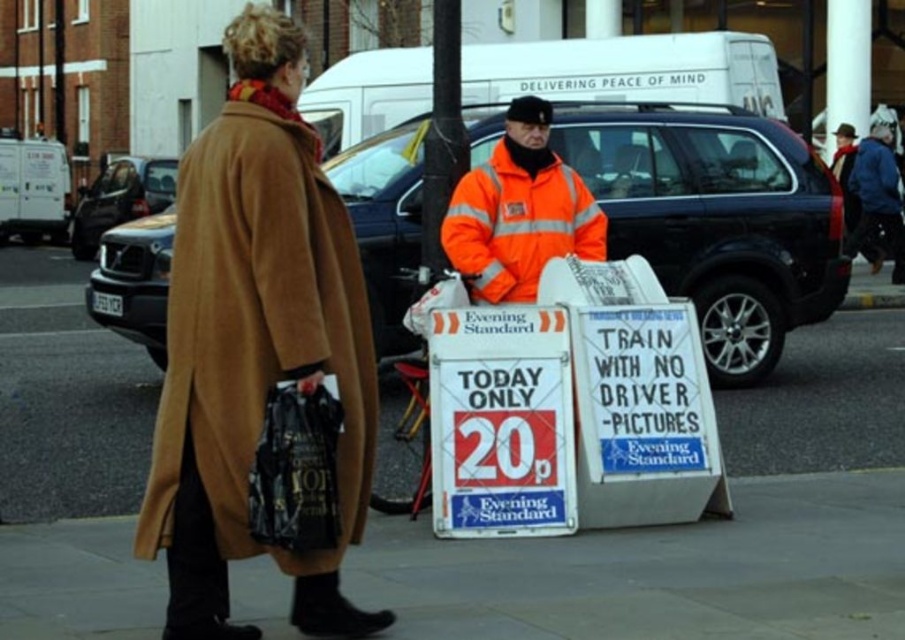
Question: Based on their relative distances, which object is farther from the smooth concrete pavement at lower center?

Choices:
 (A) high-visibility orange jacket at center
 (B) tan woolen coat at left

Answer: (B)

Question: From the image, what is the correct spatial relationship of tan woolen coat at left in relation to high-visibility orange jacket at center?

Choices:
 (A) left
 (B) right

Answer: (A)

Question: Which object is the farthest from the high-visibility orange jacket at center?

Choices:
 (A) tan woolen coat at left
 (B) smooth concrete pavement at lower center

Answer: (A)

Question: From the image, what is the correct spatial relationship of smooth concrete pavement at lower center in relation to high-visibility orange jacket at center?

Choices:
 (A) above
 (B) below

Answer: (B)

Question: Does smooth concrete pavement at lower center have a larger size compared to tan woolen coat at left?

Choices:
 (A) no
 (B) yes

Answer: (A)

Question: Among these points, which one is nearest to the camera?

Choices:
 (A) (367, 541)
 (B) (265, 234)

Answer: (B)